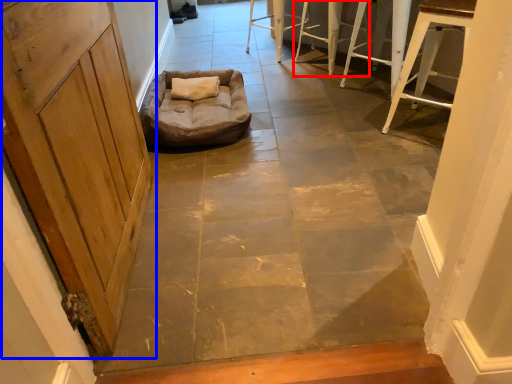
Question: Which object appears farthest to the camera in this image, furniture (highlighted by a red box) or door (highlighted by a blue box)?

Choices:
 (A) furniture
 (B) door

Answer: (A)